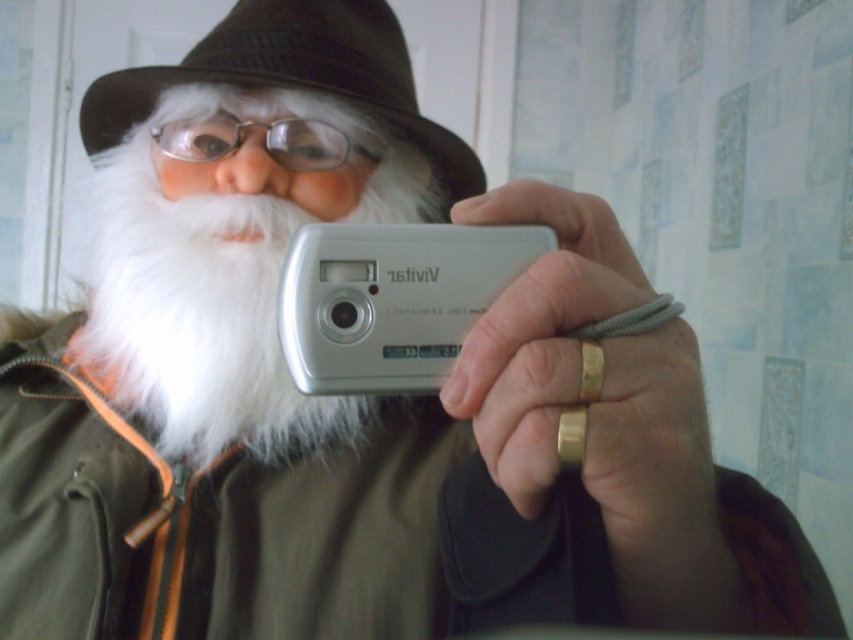
Question: From the image, what is the correct spatial relationship of silver metallic digital camera at center in relation to black felt hat at upper center?

Choices:
 (A) left
 (B) right

Answer: (B)

Question: Does white fluffy beard at center appear over black felt hat at upper center?

Choices:
 (A) yes
 (B) no

Answer: (B)

Question: Which object is the farthest from the black felt hat at upper center?

Choices:
 (A) silver metallic digital camera at center
 (B) white fluffy beard at center

Answer: (A)

Question: In this image, where is white fluffy beard at center located relative to black felt hat at upper center?

Choices:
 (A) below
 (B) above

Answer: (A)

Question: Among these objects, which one is nearest to the camera?

Choices:
 (A) silver metallic digital camera at center
 (B) white fluffy beard at center
 (C) black felt hat at upper center
 (D) clear plastic glasses at center

Answer: (A)

Question: Which object is the farthest from the silver metallic digital camera at center?

Choices:
 (A) white fluffy beard at center
 (B) black felt hat at upper center

Answer: (B)